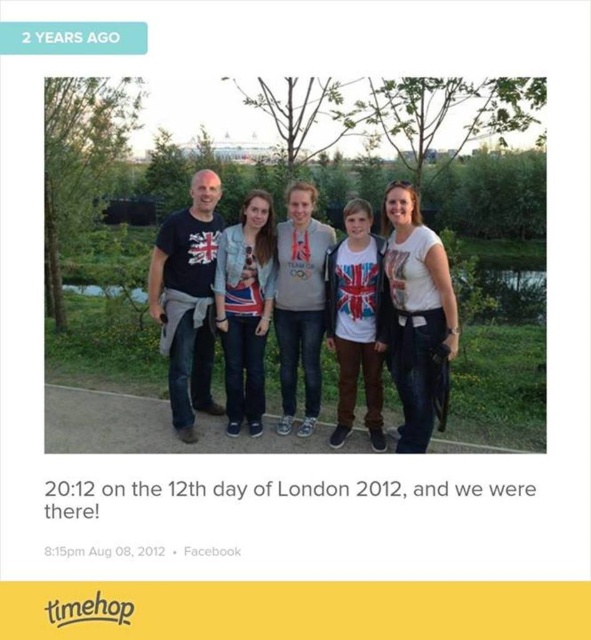
Question: Is the position of white cotton t-shirt at center less distant than that of denim jacket at center?

Choices:
 (A) yes
 (B) no

Answer: (A)

Question: Which of these objects is positioned farthest from the denim jacket at center?

Choices:
 (A) matte black t-shirt at center
 (B) white cotton t-shirt at center

Answer: (B)

Question: Among these objects, which one is farthest from the camera?

Choices:
 (A) denim jacket at center
 (B) matte black t-shirt at center

Answer: (A)

Question: Which of these objects is positioned farthest from the denim jacket at center?

Choices:
 (A) matte black t-shirt at center
 (B) white cotton t-shirt at center

Answer: (B)

Question: From the image, what is the correct spatial relationship of matte black t-shirt at center in relation to denim jacket at center?

Choices:
 (A) below
 (B) above

Answer: (A)

Question: Where is white cotton t-shirt at center located in relation to denim jacket at center in the image?

Choices:
 (A) above
 (B) below

Answer: (B)